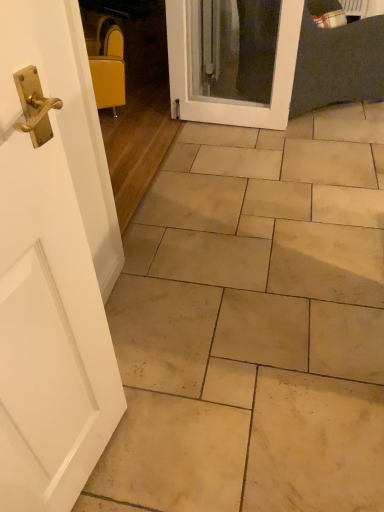
Question: Is white glossy door at center to the right of beige stone tile at center from the viewer's perspective?

Choices:
 (A) yes
 (B) no

Answer: (B)

Question: Can you confirm if white glossy door at center is thinner than beige stone tile at center?

Choices:
 (A) yes
 (B) no

Answer: (A)

Question: Can you confirm if white glossy door at center is bigger than beige stone tile at center?

Choices:
 (A) yes
 (B) no

Answer: (B)

Question: From the image's perspective, is white glossy door at center below beige stone tile at center?

Choices:
 (A) no
 (B) yes

Answer: (A)

Question: Is white glossy door at center oriented away from beige stone tile at center?

Choices:
 (A) yes
 (B) no

Answer: (B)

Question: Is white glossy door at center further to the viewer compared to beige stone tile at center?

Choices:
 (A) no
 (B) yes

Answer: (B)

Question: Are yellow fabric chair at upper left and beige stone tile at center beside each other?

Choices:
 (A) no
 (B) yes

Answer: (A)

Question: Considering the relative sizes of yellow fabric chair at upper left and beige stone tile at center in the image provided, is yellow fabric chair at upper left smaller than beige stone tile at center?

Choices:
 (A) no
 (B) yes

Answer: (B)

Question: Is beige stone tile at center surrounded by yellow fabric chair at upper left?

Choices:
 (A) no
 (B) yes

Answer: (A)

Question: Is yellow fabric chair at upper left at the left side of beige stone tile at center?

Choices:
 (A) yes
 (B) no

Answer: (A)

Question: Is the depth of yellow fabric chair at upper left less than that of beige stone tile at center?

Choices:
 (A) no
 (B) yes

Answer: (A)

Question: Can you confirm if yellow fabric chair at upper left is thinner than beige stone tile at center?

Choices:
 (A) yes
 (B) no

Answer: (A)

Question: Is white glossy door at center not inside yellow fabric chair at upper left?

Choices:
 (A) no
 (B) yes

Answer: (B)